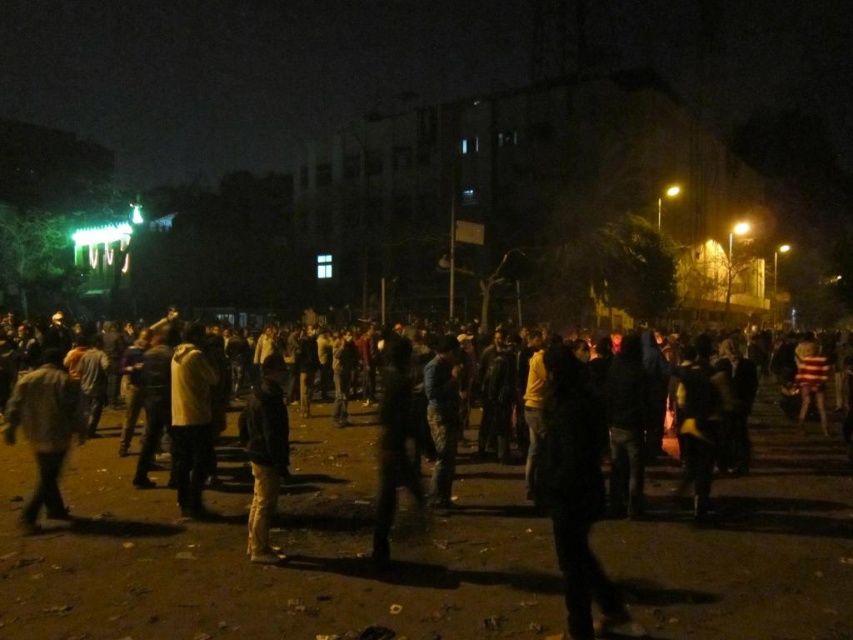
Can you confirm if dark matte jacket at center is wider than dark gray jacket at lower left?

Yes.

Between point (583, 428) and point (47, 365), which one is positioned behind?

The point (47, 365) is behind.

Which is behind, point (592, 506) or point (41, 390)?

The point (41, 390) is behind.

The width and height of the screenshot is (853, 640). I want to click on dark matte jacket at center, so click(x=576, y=497).

Which is more to the left, yellow matte jacket at center or dark gray jacket at center?

yellow matte jacket at center

Between yellow matte jacket at center and dark gray jacket at center, which one is positioned lower?

Positioned lower is dark gray jacket at center.

Does point (184, 516) come behind point (253, 536)?

Yes.

The width and height of the screenshot is (853, 640). Find the location of `yellow matte jacket at center`. yellow matte jacket at center is located at coordinates (190, 419).

This screenshot has height=640, width=853. What do you see at coordinates (44, 429) in the screenshot? I see `dark gray jacket at lower left` at bounding box center [44, 429].

Measure the distance from dark gray jacket at lower left to yellow matte jacket at center.

They are 1.19 meters apart.

What do you see at coordinates (44, 429) in the screenshot? I see `dark gray jacket at lower left` at bounding box center [44, 429].

You are a GUI agent. You are given a task and a screenshot of the screen. Output one action in this format:
    pyautogui.click(x=<x>, y=<y>)
    Task: Click on the dark gray jacket at lower left
    
    Given the screenshot: What is the action you would take?
    pyautogui.click(x=44, y=429)